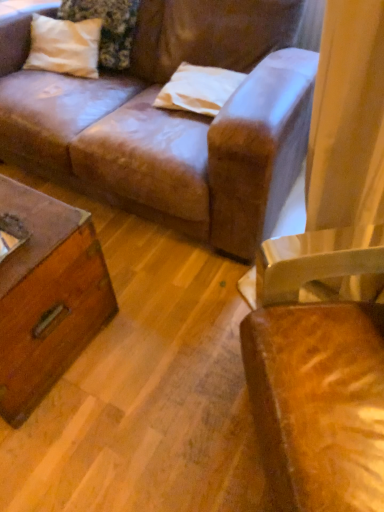
Question: In which direction should I rotate to look at white matte pillow at upper center, placed as the first pillow when sorted from right to left?

Choices:
 (A) right
 (B) left

Answer: (A)

Question: Is the depth of leather chair at right less than that of white cotton pillow at upper left, which ranks as the 1th pillow in top-to-bottom order?

Choices:
 (A) no
 (B) yes

Answer: (B)

Question: Can you confirm if leather chair at right is thinner than white cotton pillow at upper left, which is the 2th pillow in bottom-to-top order?

Choices:
 (A) no
 (B) yes

Answer: (A)

Question: Is leather chair at right looking in the opposite direction of white cotton pillow at upper left, which is the 2th pillow in bottom-to-top order?

Choices:
 (A) no
 (B) yes

Answer: (A)

Question: From a real-world perspective, is leather chair at right located beneath white cotton pillow at upper left, which is the second pillow in right-to-left order?

Choices:
 (A) yes
 (B) no

Answer: (A)

Question: From the image's perspective, would you say leather chair at right is positioned over white cotton pillow at upper left, which ranks as the 1th pillow in top-to-bottom order?

Choices:
 (A) no
 (B) yes

Answer: (A)

Question: From a real-world perspective, is leather chair at right positioned over white cotton pillow at upper left, acting as the first pillow starting from the left, based on gravity?

Choices:
 (A) yes
 (B) no

Answer: (B)

Question: Could you tell me if leather chair at right is facing white matte pillow at upper center, placed as the 2th pillow when sorted from top to bottom?

Choices:
 (A) no
 (B) yes

Answer: (A)

Question: From the image's perspective, would you say leather chair at right is shown under white matte pillow at upper center, placed as the first pillow when sorted from right to left?

Choices:
 (A) yes
 (B) no

Answer: (A)

Question: Is white matte pillow at upper center, placed as the first pillow when sorted from right to left, at the back of leather chair at right?

Choices:
 (A) yes
 (B) no

Answer: (B)

Question: Is leather chair at right behind white matte pillow at upper center, placed as the first pillow when sorted from right to left?

Choices:
 (A) no
 (B) yes

Answer: (A)

Question: From the image's perspective, is leather chair at right above white matte pillow at upper center, the 1th pillow in the bottom-to-top sequence?

Choices:
 (A) yes
 (B) no

Answer: (B)

Question: Is leather chair at right to the right of white matte pillow at upper center, the 1th pillow in the bottom-to-top sequence, from the viewer's perspective?

Choices:
 (A) yes
 (B) no

Answer: (A)

Question: Is white matte pillow at upper center, the second pillow in the left-to-right sequence, to the left of leather chair at right from the viewer's perspective?

Choices:
 (A) no
 (B) yes

Answer: (B)